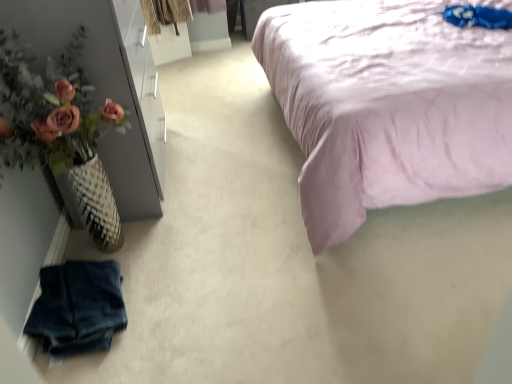
What do you see at coordinates (78, 307) in the screenshot? This screenshot has width=512, height=384. I see `faded denim shorts at lower left` at bounding box center [78, 307].

What is the approximate width of faded denim shorts at lower left?

It is 11.94 inches.

What do you see at coordinates (387, 105) in the screenshot? I see `lavender satin bed at upper right` at bounding box center [387, 105].

You are a GUI agent. You are given a task and a screenshot of the screen. Output one action in this format:
    pyautogui.click(x=<x>, y=<y>)
    Task: Click on the lavender satin bed at upper right
    This screenshot has height=384, width=512.
    Given the screenshot: What is the action you would take?
    pyautogui.click(x=387, y=105)

The width and height of the screenshot is (512, 384). Describe the element at coordinates (50, 108) in the screenshot. I see `matte pink flowers at left` at that location.

At what (x,y) coordinates should I click in order to perform the action: click on faded denim shorts at lower left. Please return your answer as a coordinate pair (x, y). The image size is (512, 384). Looking at the image, I should click on (78, 307).

This screenshot has height=384, width=512. I want to click on clothing lying in front of the matte pink flowers at left, so point(78,307).

Considering the sizes of matte pink flowers at left and faded denim shorts at lower left in the image, is matte pink flowers at left taller or shorter than faded denim shorts at lower left?

matte pink flowers at left is taller than faded denim shorts at lower left.

In the scene shown: Is matte pink flowers at left completely or partially outside of faded denim shorts at lower left?

Yes, matte pink flowers at left is outside of faded denim shorts at lower left.

At what (x,y) coordinates should I click in order to perform the action: click on clothing lying on the right of matte pink flowers at left. Please return your answer as a coordinate pair (x, y). The image size is (512, 384). Looking at the image, I should click on (78, 307).

Between point (33, 314) and point (4, 128), which one is positioned in front?

The point (4, 128) is more forward.

Measure the distance between faded denim shorts at lower left and matte pink flowers at left.

20.84 inches.

From a real-world perspective, does faded denim shorts at lower left stand above matte pink flowers at left?

Incorrect, from a real-world perspective, faded denim shorts at lower left is lower than matte pink flowers at left.

Can you confirm if matte pink flowers at left is positioned to the right of lavender satin bed at upper right?

In fact, matte pink flowers at left is to the left of lavender satin bed at upper right.

From a real-world perspective, is matte pink flowers at left positioned above or below lavender satin bed at upper right?

matte pink flowers at left is above lavender satin bed at upper right.

From the image's perspective, would you say matte pink flowers at left is shown under lavender satin bed at upper right?

Yes, from the image's perspective, matte pink flowers at left is below lavender satin bed at upper right.

Is matte pink flowers at left positioned behind lavender satin bed at upper right?

Yes, it is.

From a real-world perspective, is lavender satin bed at upper right positioned above or below matte pink flowers at left?

In terms of real-world spatial position, lavender satin bed at upper right is below matte pink flowers at left.

Does lavender satin bed at upper right have a lesser width compared to matte pink flowers at left?

No, lavender satin bed at upper right is not thinner than matte pink flowers at left.

Is matte pink flowers at left located within lavender satin bed at upper right?

Actually, matte pink flowers at left is outside lavender satin bed at upper right.

Does lavender satin bed at upper right contain faded denim shorts at lower left?

No, lavender satin bed at upper right does not contain faded denim shorts at lower left.

From the image's perspective, is lavender satin bed at upper right located above faded denim shorts at lower left?

Yes, from the image's perspective, lavender satin bed at upper right is over faded denim shorts at lower left.

From a real-world perspective, is lavender satin bed at upper right over faded denim shorts at lower left?

Yes, from a real-world perspective, lavender satin bed at upper right is over faded denim shorts at lower left

Which is more to the right, lavender satin bed at upper right or faded denim shorts at lower left?

lavender satin bed at upper right.

From the image's perspective, does faded denim shorts at lower left appear lower than lavender satin bed at upper right?

Correct, faded denim shorts at lower left appears lower than lavender satin bed at upper right in the image.

How much distance is there between faded denim shorts at lower left and lavender satin bed at upper right?

1.12 meters.

The height and width of the screenshot is (384, 512). What are the coordinates of `clothing that is under the lavender satin bed at upper right (from a real-world perspective)` in the screenshot? It's located at (78, 307).

How different are the orientations of faded denim shorts at lower left and lavender satin bed at upper right in degrees?

They differ by 179 degrees in their facing directions.

The image size is (512, 384). What are the coordinates of `clothing below the matte pink flowers at left (from the image's perspective)` in the screenshot? It's located at (78, 307).

The width and height of the screenshot is (512, 384). I want to click on clothing in front of the matte pink flowers at left, so click(78, 307).

Considering their positions, is lavender satin bed at upper right positioned closer to faded denim shorts at lower left than matte pink flowers at left?

matte pink flowers at left.

From the picture: When comparing their distances from lavender satin bed at upper right, does faded denim shorts at lower left or matte pink flowers at left seem further?

faded denim shorts at lower left lies further to lavender satin bed at upper right than the other object.

From the picture: When comparing their distances from matte pink flowers at left, does faded denim shorts at lower left or lavender satin bed at upper right seem further?

Among the two, lavender satin bed at upper right is located further to matte pink flowers at left.

When comparing their distances from matte pink flowers at left, does lavender satin bed at upper right or faded denim shorts at lower left seem closer?

faded denim shorts at lower left.

Considering their positions, is matte pink flowers at left positioned closer to lavender satin bed at upper right than faded denim shorts at lower left?

Based on the image, matte pink flowers at left appears to be nearer to lavender satin bed at upper right.

Considering their positions, is matte pink flowers at left positioned closer to faded denim shorts at lower left than lavender satin bed at upper right?

matte pink flowers at left is closer to faded denim shorts at lower left.

What are the coordinates of `clothing between matte pink flowers at left and lavender satin bed at upper right from left to right` in the screenshot? It's located at (78, 307).